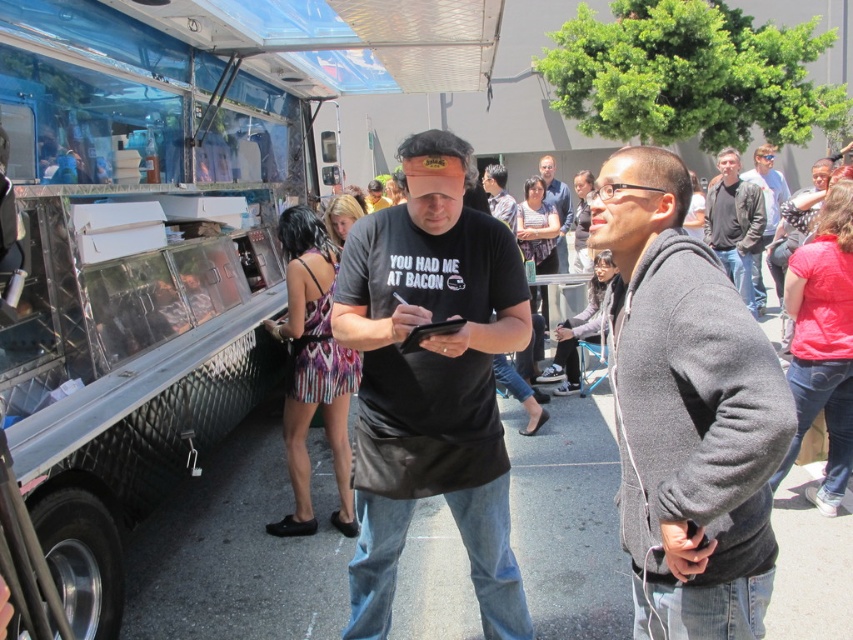
In the scene shown: You are standing at the food truck event and want to take a photo of both the person on the left and the person on the right. Which point should you focus on first to ensure both are in focus? Please choose between point A at point (109,552) and point B at point (451,168).

You should focus on point A at point (109,552) first because it is closer to the camera than point B at point (451,168). By focusing on the closer point, the depth of field may help keep both subjects in focus.